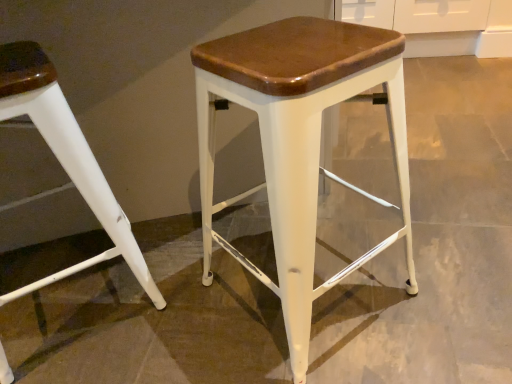
Question: From the image's perspective, relative to white matte stool at left, marked as the second stool in a right-to-left arrangement, is matte white stool at center, acting as the first stool starting from the right, above or below?

Choices:
 (A) below
 (B) above

Answer: (B)

Question: Is matte white stool at center, acting as the first stool starting from the right, spatially inside white matte stool at left, which is counted as the first stool, starting from the left, or outside of it?

Choices:
 (A) inside
 (B) outside

Answer: (B)

Question: Is matte white stool at center, which ranks as the second stool in left-to-right order, to the left or to the right of white matte stool at left, which is counted as the first stool, starting from the left, in the image?

Choices:
 (A) right
 (B) left

Answer: (A)

Question: Considering the positions of white matte stool at left, which is counted as the first stool, starting from the left, and matte white stool at center, acting as the first stool starting from the right, in the image, is white matte stool at left, which is counted as the first stool, starting from the left, taller or shorter than matte white stool at center, acting as the first stool starting from the right,?

Choices:
 (A) short
 (B) tall

Answer: (A)

Question: Looking at their shapes, would you say white matte stool at left, which is counted as the first stool, starting from the left, is wider or thinner than matte white stool at center, which ranks as the second stool in left-to-right order?

Choices:
 (A) thin
 (B) wide

Answer: (B)

Question: From the image's perspective, relative to matte white stool at center, acting as the first stool starting from the right, is white matte stool at left, marked as the second stool in a right-to-left arrangement, above or below?

Choices:
 (A) below
 (B) above

Answer: (A)

Question: From a real-world perspective, is white matte stool at left, which is counted as the first stool, starting from the left, physically located above or below matte white stool at center, which ranks as the second stool in left-to-right order?

Choices:
 (A) below
 (B) above

Answer: (A)